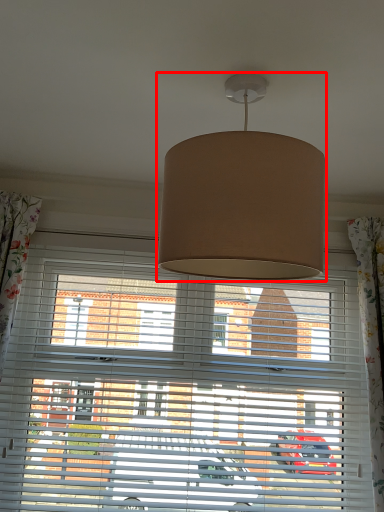
Question: In this image, where is lamp (annotated by the red box) located relative to window blind?

Choices:
 (A) right
 (B) left

Answer: (A)